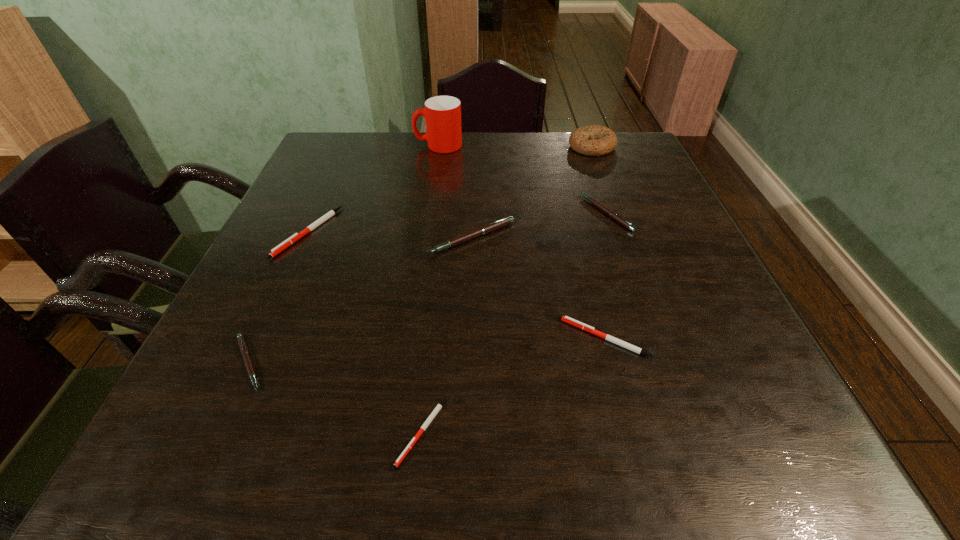
You are a GUI agent. You are given a task and a screenshot of the screen. Output one action in this format:
    pyautogui.click(x=<x>, y=<y>)
    Task: Click on the smallest pink pen
    
    Given the screenshot: What is the action you would take?
    pyautogui.click(x=244, y=351)

This screenshot has width=960, height=540. What are the coordinates of `the rightmost white pen` in the screenshot? It's located at (590, 329).

Identify the location of the second smallest white pen. Image resolution: width=960 pixels, height=540 pixels. (590, 329).

The height and width of the screenshot is (540, 960). Identify the location of the second white pen from left to right. (439, 406).

Find the location of a particular element. The image size is (960, 540). the smallest white pen is located at coordinates (439, 406).

The image size is (960, 540). I want to click on vacant point located on the side of the tallest object with the handle, so click(350, 146).

Find the location of a particular element. This screenshot has height=540, width=960. vacant space located 0.080m on the side of the tallest object with the handle is located at coordinates (387, 146).

I want to click on vacant region located 0.280m on the side of the tallest object with the handle, so click(320, 146).

Locate an element on the screen. This screenshot has width=960, height=540. blank space located 0.150m on the front of the second tallest object is located at coordinates (608, 187).

At what (x,y) coordinates should I click in order to perform the action: click on vacant space located at the nib of the second pink pen from left to right. Please return your answer as a coordinate pair (x, y). Looking at the image, I should click on (471, 283).